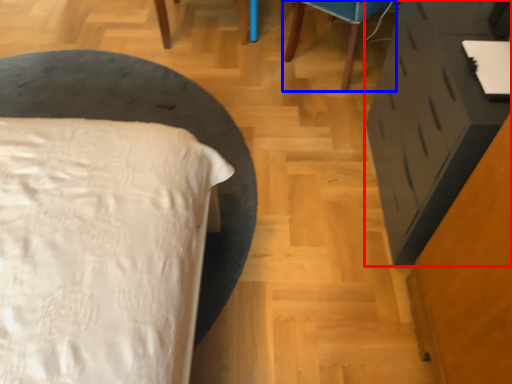
Question: Which object appears closest to the camera in this image, vanity (highlighted by a red box) or furniture (highlighted by a blue box)?

Choices:
 (A) vanity
 (B) furniture

Answer: (A)